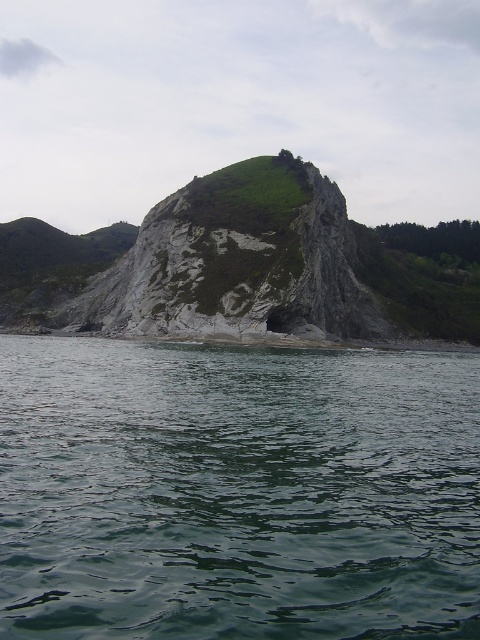
Looking at this image, is green liquid water at center further to camera compared to rough gray rock at center?

No, it is not.

Between green liquid water at center and rough gray rock at center, which one is positioned higher?

rough gray rock at center is above.

Which is behind, point (51, 625) or point (321, 301)?

The point (321, 301) is behind.

Identify the location of green liquid water at center. (237, 492).